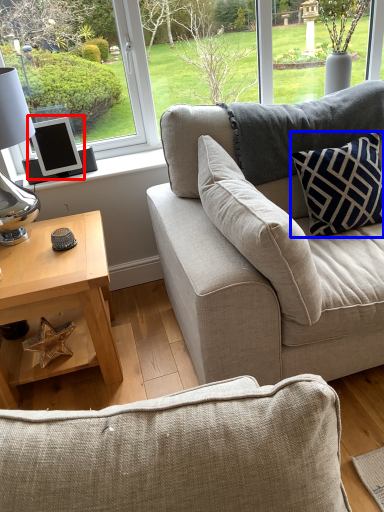
Question: Which object is closer to the camera taking this photo, computer monitor (highlighted by a red box) or pillow (highlighted by a blue box)?

Choices:
 (A) computer monitor
 (B) pillow

Answer: (B)